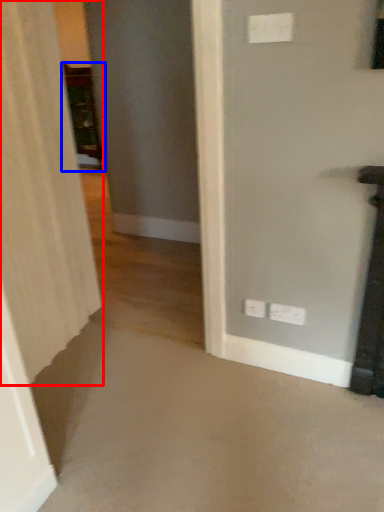
Question: Which object appears farthest to the camera in this image, curtain (highlighted by a red box) or furniture (highlighted by a blue box)?

Choices:
 (A) curtain
 (B) furniture

Answer: (B)